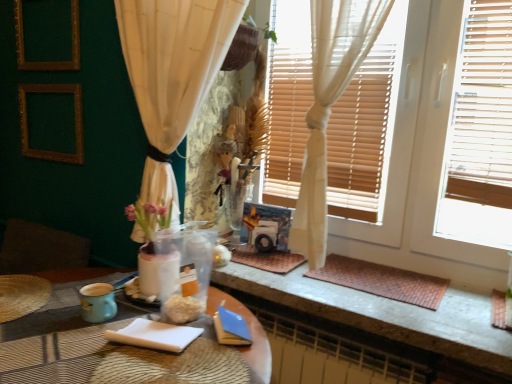
This screenshot has height=384, width=512. I want to click on vacant space underneath white paper notepad at lower center (from a real-world perspective), so click(160, 330).